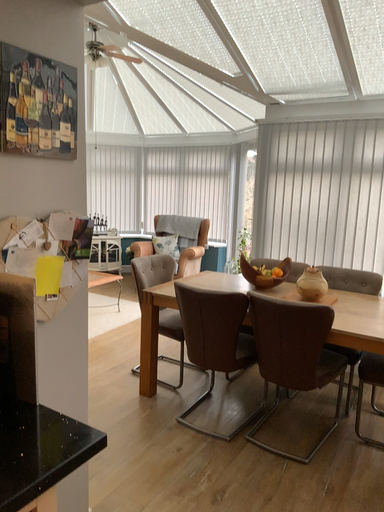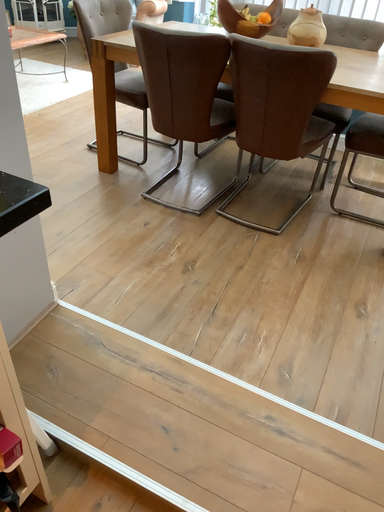
Question: How did the camera likely rotate when shooting the video?

Choices:
 (A) rotated downward
 (B) rotated upward

Answer: (A)